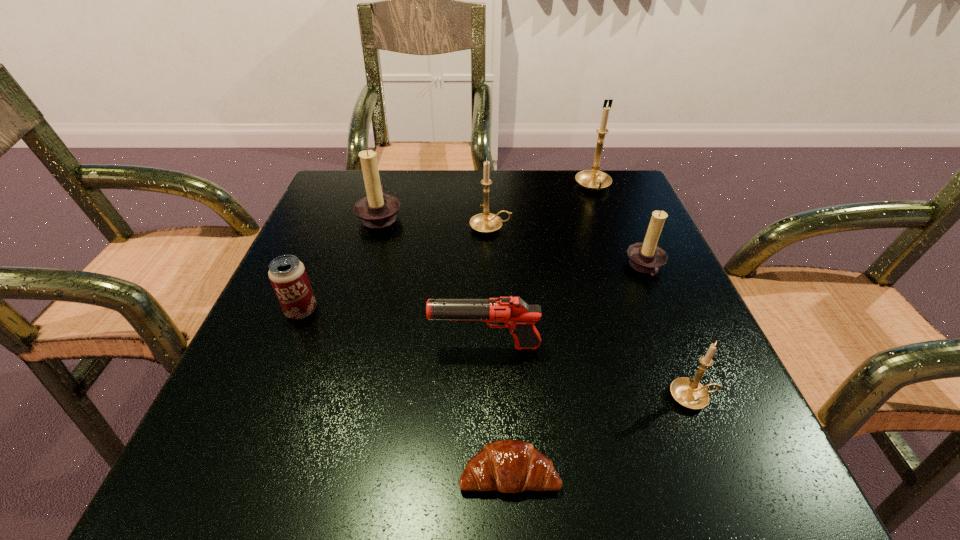
You are a GUI agent. You are given a task and a screenshot of the screen. Output one action in this format:
    pyautogui.click(x=<x>, y=<y>)
    Task: Click on the object identified as the third closest to the second biggest gold candle holder
    
    Given the screenshot: What is the action you would take?
    pyautogui.click(x=647, y=257)

I want to click on candle holder that stands as the third closest to the tallest candle holder, so click(377, 210).

I want to click on candle holder that is the closest to the smallest gold candle holder, so click(x=647, y=257).

Where is `gold candle holder that is the nearest to the nearest gold candle holder`? gold candle holder that is the nearest to the nearest gold candle holder is located at coordinates (485, 222).

Identify which gold candle holder is located as the nearest to the second nearest object. Please provide its 2D coordinates. Your answer should be formatted as a tuple, i.e. [(x, y)], where the tuple contains the x and y coordinates of a point satisfying the conditions above.

[(485, 222)]

Image resolution: width=960 pixels, height=540 pixels. Find the location of `free space that satisfies the following two spatial constraints: 1. on the handle side of the tallest object; 2. on the wick of the bigger brown candle holder`. free space that satisfies the following two spatial constraints: 1. on the handle side of the tallest object; 2. on the wick of the bigger brown candle holder is located at coordinates (604, 214).

Find the location of `free space that satisfies the following two spatial constraints: 1. on the handle side of the nearest gold candle holder; 2. on the front side of the shortest object`. free space that satisfies the following two spatial constraints: 1. on the handle side of the nearest gold candle holder; 2. on the front side of the shortest object is located at coordinates (724, 472).